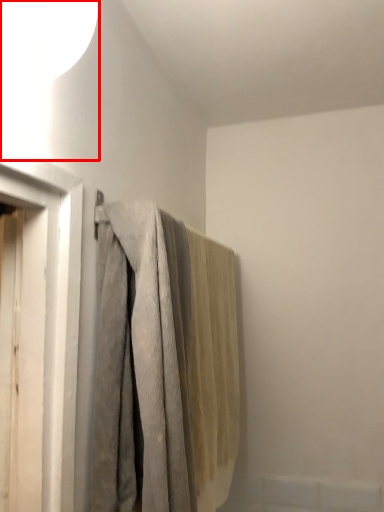
Question: In this image, where is lamp (annotated by the red box) located relative to curtain?

Choices:
 (A) right
 (B) left

Answer: (B)